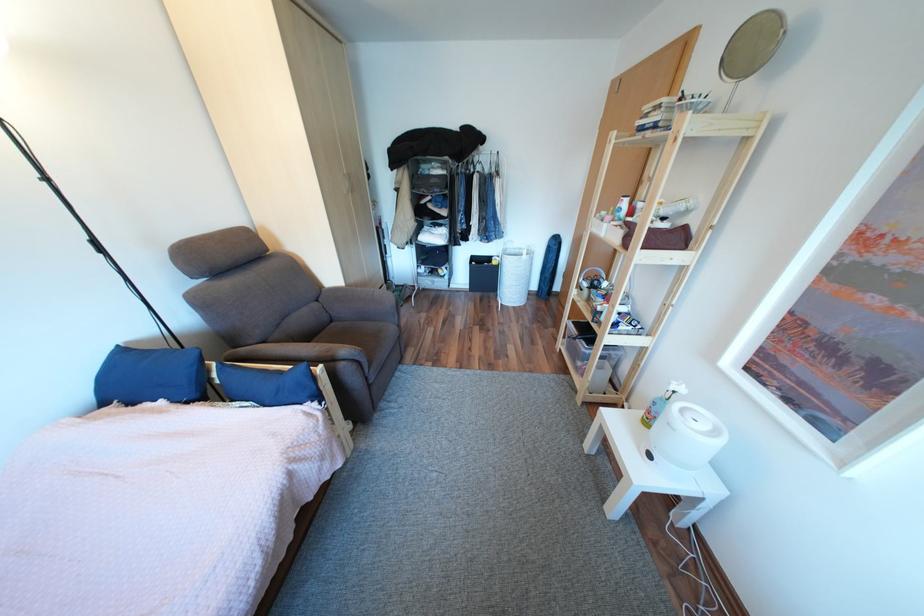
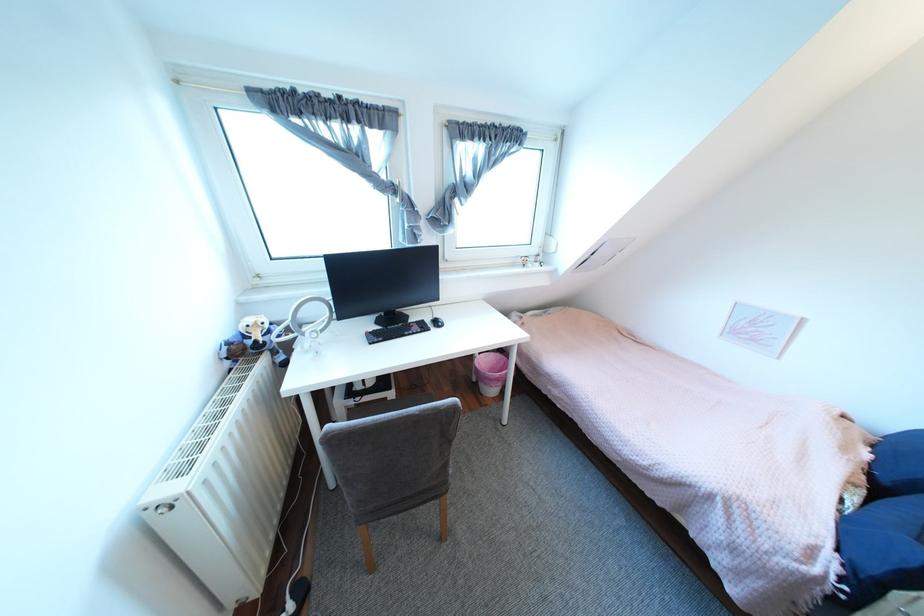
The point at (330, 397) is marked in the first image. Where is the corresponding point in the second image?

(873, 586)